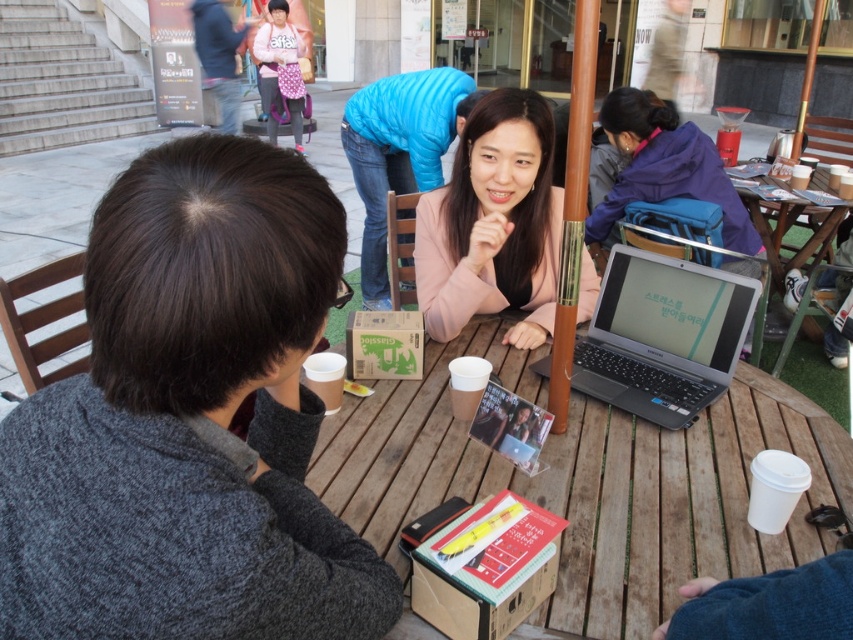
Does pink matte jacket at center have a lesser height compared to silver/black plastic laptop at center?

No.

From the picture: Which is more to the left, pink matte jacket at center or silver/black plastic laptop at center?

pink matte jacket at center is more to the left.

The image size is (853, 640). I want to click on pink matte jacket at center, so click(492, 224).

Is dark gray sweater at upper left above wooden picnic table at right?

No, dark gray sweater at upper left is not above wooden picnic table at right.

Locate an element on the screen. Image resolution: width=853 pixels, height=640 pixels. dark gray sweater at upper left is located at coordinates (189, 420).

The height and width of the screenshot is (640, 853). What do you see at coordinates (189, 420) in the screenshot? I see `dark gray sweater at upper left` at bounding box center [189, 420].

Identify the location of dark gray sweater at upper left. Image resolution: width=853 pixels, height=640 pixels. (189, 420).

Does dark gray sweater at upper left have a greater width compared to pink fabric bag at upper center?

In fact, dark gray sweater at upper left might be narrower than pink fabric bag at upper center.

Between dark gray sweater at upper left and pink fabric bag at upper center, which one appears on the left side from the viewer's perspective?

pink fabric bag at upper center is more to the left.

Does point (263, 307) lie in front of point (291, 100)?

Yes.

Where is `dark gray sweater at upper left`? The width and height of the screenshot is (853, 640). dark gray sweater at upper left is located at coordinates [189, 420].